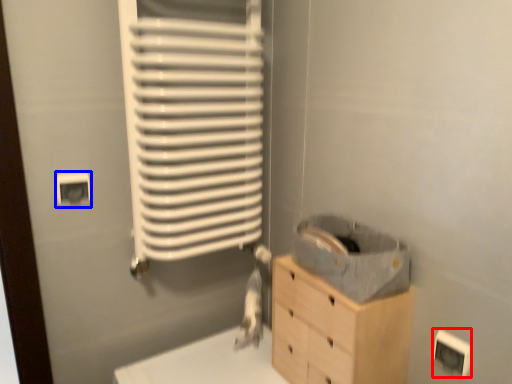
Question: Among these objects, which one is nearest to the camera, electric outlet (highlighted by a red box) or electric outlet (highlighted by a blue box)?

Choices:
 (A) electric outlet
 (B) electric outlet

Answer: (A)